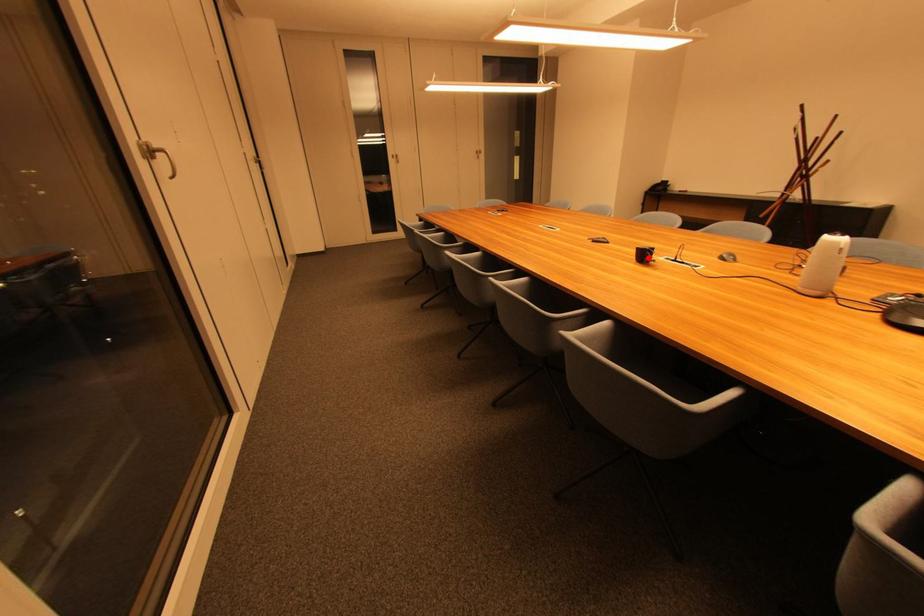
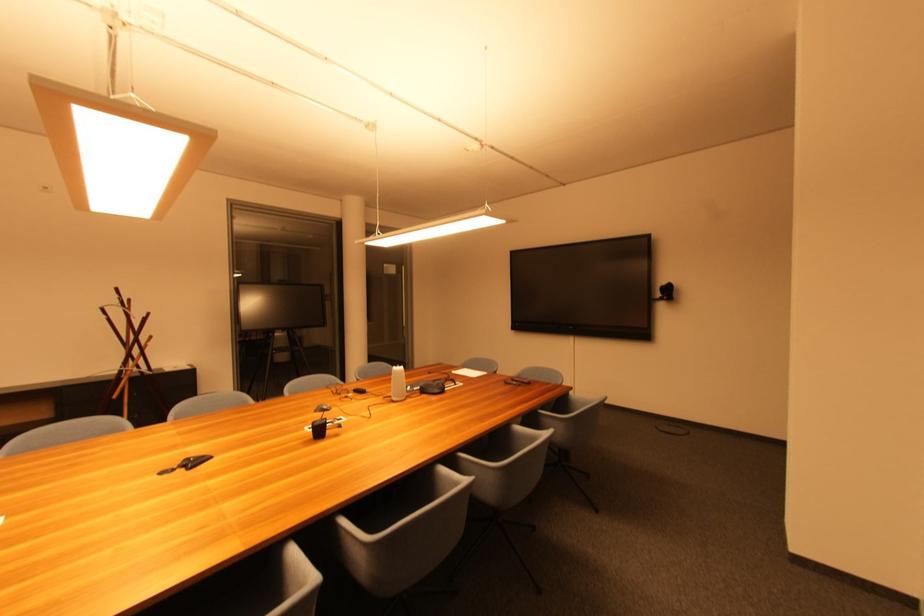
Find the pixel in the second image that matches the highlighted location in the first image.

(324, 432)